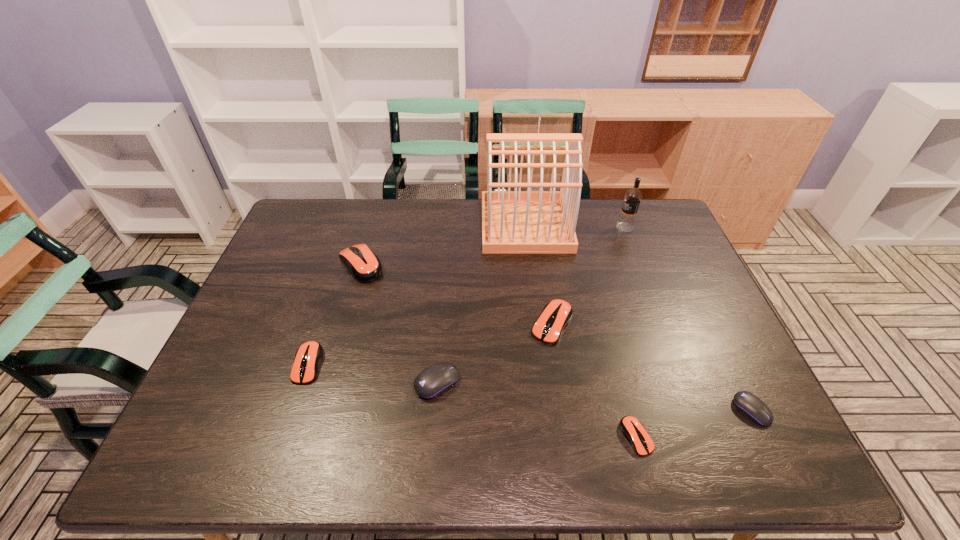
The image size is (960, 540). Find the location of `the second smallest orange computer mouse`. the second smallest orange computer mouse is located at coordinates (307, 359).

The width and height of the screenshot is (960, 540). Identify the location of the rightmost object. (748, 404).

The image size is (960, 540). What are the coordinates of `the rightmost computer mouse` in the screenshot? It's located at (748, 404).

The height and width of the screenshot is (540, 960). I want to click on the smallest orange computer mouse, so click(x=633, y=430).

The width and height of the screenshot is (960, 540). Find the location of `the nearest orange computer mouse`. the nearest orange computer mouse is located at coordinates (633, 430).

Locate an element on the screen. This screenshot has height=540, width=960. free space located 0.160m with an open door on the tallest object is located at coordinates (436, 225).

Find the location of a particular element. The height and width of the screenshot is (540, 960). blank space located with an open door on the tallest object is located at coordinates (427, 225).

Identify the location of free space located 0.180m with an open door on the tallest object. (430, 225).

Where is `vacant region located 0.240m on the label of the seventh shortest object`? Image resolution: width=960 pixels, height=540 pixels. vacant region located 0.240m on the label of the seventh shortest object is located at coordinates (545, 227).

Identify the location of free location located on the label of the seventh shortest object. (542, 227).